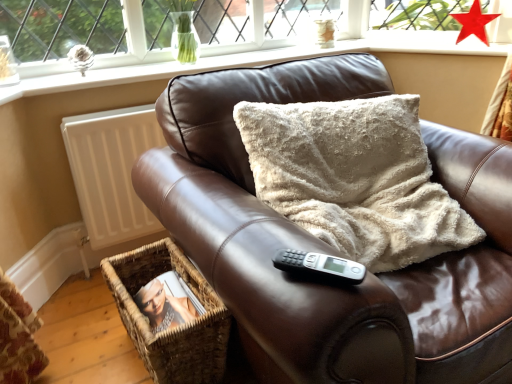
This screenshot has height=384, width=512. What do you see at coordinates (170, 330) in the screenshot?
I see `woven brown basket at lower left` at bounding box center [170, 330].

Find the location of a particular element. The width and height of the screenshot is (512, 384). smooth white surface at upper center is located at coordinates (239, 63).

Identify the location of red glass star at upper right. (474, 23).

Describe the element at coordinates (474, 23) in the screenshot. This screenshot has width=512, height=384. I see `red glass star at upper right` at that location.

What do you see at coordinates (111, 171) in the screenshot? The image size is (512, 384). I see `white matte radiator at left` at bounding box center [111, 171].

Identify the location of black plastic remote at center. The height and width of the screenshot is (384, 512). (320, 266).

Find the location of a particular element. woven brown basket at lower left is located at coordinates [x=170, y=330].

From the image's perspective, which is above, white matte radiator at left or red glass star at upper right?

red glass star at upper right.

Looking at this image, is white matte radiator at left closer to the viewer compared to red glass star at upper right?

Yes, the depth of white matte radiator at left is less than that of red glass star at upper right.

Is white matte radiator at left oriented towards red glass star at upper right?

No, white matte radiator at left is not turned towards red glass star at upper right.

Considering the relative sizes of white matte radiator at left and red glass star at upper right in the image provided, is white matte radiator at left shorter than red glass star at upper right?

No, white matte radiator at left is not shorter than red glass star at upper right.

Who is shorter, red glass star at upper right or woven brown basket at lower left?

red glass star at upper right.

From a real-world perspective, is red glass star at upper right physically below woven brown basket at lower left?

Actually, red glass star at upper right is physically above woven brown basket at lower left in the real world.

Does brown leather couch at center come in front of smooth white surface at upper center?

Yes.

Identify the location of window sill located behind the brown leather couch at center. (239, 63).

Is point (146, 170) more distant than point (343, 50)?

No, (146, 170) is in front of (343, 50).

Is smooth white surface at upper center surrounded by brown leather couch at center?

No, smooth white surface at upper center is not inside brown leather couch at center.

Considering the positions of objects smooth white surface at upper center and red glass star at upper right in the image provided, who is behind, smooth white surface at upper center or red glass star at upper right?

red glass star at upper right is more distant.

Considering the relative sizes of smooth white surface at upper center and red glass star at upper right in the image provided, is smooth white surface at upper center shorter than red glass star at upper right?

Correct, smooth white surface at upper center is not as tall as red glass star at upper right.

Can you see smooth white surface at upper center touching red glass star at upper right?

They are not placed beside each other.

How many degrees apart are the facing directions of smooth white surface at upper center and red glass star at upper right?

64.3 degrees separate the facing orientations of smooth white surface at upper center and red glass star at upper right.

How different are the orientations of white matte radiator at left and black plastic remote at center in degrees?

The angular difference between white matte radiator at left and black plastic remote at center is 38.6 degrees.

From a real-world perspective, is white matte radiator at left below black plastic remote at center?

Yes.

Is white matte radiator at left facing towards black plastic remote at center?

Yes, white matte radiator at left is aimed at black plastic remote at center.

Based on the photo, based on their sizes in the image, would you say white matte radiator at left is bigger or smaller than black plastic remote at center?

In the image, white matte radiator at left appears to be larger than black plastic remote at center.

Does brown leather couch at center have a larger size compared to woven brown basket at lower left?

Yes, brown leather couch at center is bigger than woven brown basket at lower left.

Choose the correct answer: Is brown leather couch at center inside woven brown basket at lower left or outside it?

brown leather couch at center exists outside the volume of woven brown basket at lower left.

In terms of height, does brown leather couch at center look taller or shorter compared to woven brown basket at lower left?

Considering their sizes, brown leather couch at center has more height than woven brown basket at lower left.

Can you confirm if black plastic remote at center is positioned to the left of woven brown basket at lower left?

No.

Which is correct: black plastic remote at center is inside woven brown basket at lower left, or outside of it?

black plastic remote at center exists outside the volume of woven brown basket at lower left.

Locate an element on the screen. The height and width of the screenshot is (384, 512). basket below the black plastic remote at center (from a real-world perspective) is located at coordinates (170, 330).

Measure the distance between black plastic remote at center and woven brown basket at lower left.

They are 26.69 inches apart.

Identify the location of radiator that appears in front of the red glass star at upper right. (111, 171).

Identify the location of basket below the red glass star at upper right (from the image's perspective). Image resolution: width=512 pixels, height=384 pixels. (170, 330).

Considering their positions, is black plastic remote at center positioned closer to brown leather couch at center than woven brown basket at lower left?

black plastic remote at center is closer to brown leather couch at center.

When comparing their distances from woven brown basket at lower left, does smooth white surface at upper center or brown leather couch at center seem further?

Among the two, smooth white surface at upper center is located further to woven brown basket at lower left.

Based on their spatial positions, is woven brown basket at lower left or black plastic remote at center closer to brown leather couch at center?

black plastic remote at center is positioned closer to the anchor brown leather couch at center.

In the scene shown: Looking at the image, which one is located further to woven brown basket at lower left, red glass star at upper right or brown leather couch at center?

Based on the image, red glass star at upper right appears to be further to woven brown basket at lower left.

Looking at the image, which one is located further to red glass star at upper right, brown leather couch at center or smooth white surface at upper center?

brown leather couch at center is further to red glass star at upper right.

Estimate the real-world distances between objects in this image. Which object is closer to brown leather couch at center, white matte radiator at left or woven brown basket at lower left?

woven brown basket at lower left.

Looking at the image, which one is located closer to red glass star at upper right, white matte radiator at left or brown leather couch at center?

brown leather couch at center is positioned closer to the anchor red glass star at upper right.

From the image, which object appears to be nearer to red glass star at upper right, woven brown basket at lower left or smooth white surface at upper center?

smooth white surface at upper center.

Where is `remote between woven brown basket at lower left and red glass star at upper right in the horizontal direction`? remote between woven brown basket at lower left and red glass star at upper right in the horizontal direction is located at coordinates pyautogui.click(x=320, y=266).

Find the location of a particular element. This screenshot has height=384, width=512. basket between white matte radiator at left and red glass star at upper right is located at coordinates (170, 330).

You are a GUI agent. You are given a task and a screenshot of the screen. Output one action in this format:
    pyautogui.click(x=<x>, y=<y>)
    Task: Click on the basket between brown leather couch at center and red glass star at upper right in the front-back direction
    This screenshot has width=512, height=384.
    Given the screenshot: What is the action you would take?
    pyautogui.click(x=170, y=330)

The width and height of the screenshot is (512, 384). Find the location of `basket located between brown leather couch at center and white matte radiator at left in the depth direction`. basket located between brown leather couch at center and white matte radiator at left in the depth direction is located at coordinates (170, 330).